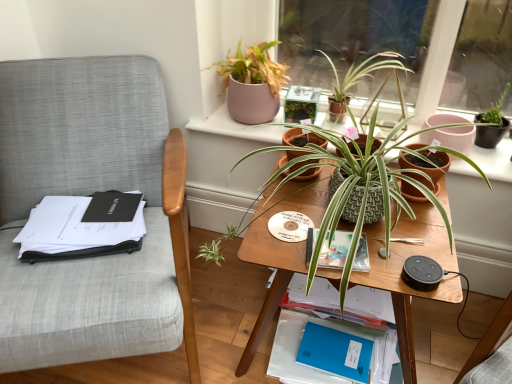
Locate an element on the screen. free spot above wooden table at center (from a real-world perspective) is located at coordinates (352, 223).